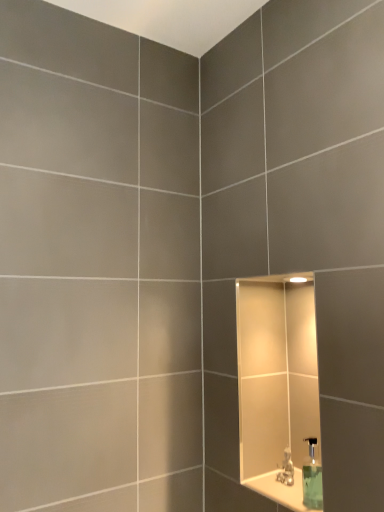
Question: From the image's perspective, does white glossy ledge at lower right appear lower than green translucent soap dispenser at lower right?

Choices:
 (A) no
 (B) yes

Answer: (B)

Question: Is white glossy ledge at lower right beside green translucent soap dispenser at lower right?

Choices:
 (A) yes
 (B) no

Answer: (A)

Question: Is white glossy ledge at lower right aimed at green translucent soap dispenser at lower right?

Choices:
 (A) no
 (B) yes

Answer: (A)

Question: Is green translucent soap dispenser at lower right surrounded by white glossy ledge at lower right?

Choices:
 (A) yes
 (B) no

Answer: (B)

Question: Does white glossy ledge at lower right appear on the left side of green translucent soap dispenser at lower right?

Choices:
 (A) yes
 (B) no

Answer: (B)

Question: Based on their sizes in the image, would you say satin nickel faucet at lower right is bigger or smaller than white glossy ledge at lower right?

Choices:
 (A) big
 (B) small

Answer: (B)

Question: From the image's perspective, is satin nickel faucet at lower right located above or below white glossy ledge at lower right?

Choices:
 (A) above
 (B) below

Answer: (A)

Question: Is satin nickel faucet at lower right taller or shorter than white glossy ledge at lower right?

Choices:
 (A) short
 (B) tall

Answer: (B)

Question: Does point (292, 466) appear closer or farther from the camera than point (279, 492)?

Choices:
 (A) farther
 (B) closer

Answer: (A)

Question: Looking at the image, does white glossy ledge at lower right seem bigger or smaller compared to green translucent soap dispenser at lower right?

Choices:
 (A) big
 (B) small

Answer: (B)

Question: Is point (306, 508) closer or farther from the camera than point (309, 441)?

Choices:
 (A) farther
 (B) closer

Answer: (B)

Question: Considering their positions, is white glossy ledge at lower right located in front of or behind green translucent soap dispenser at lower right?

Choices:
 (A) front
 (B) behind

Answer: (A)

Question: From the image's perspective, is white glossy ledge at lower right located above or below green translucent soap dispenser at lower right?

Choices:
 (A) above
 (B) below

Answer: (B)

Question: Looking at their shapes, would you say green translucent soap dispenser at lower right is wider or thinner than satin nickel faucet at lower right?

Choices:
 (A) thin
 (B) wide

Answer: (B)

Question: From the image's perspective, relative to satin nickel faucet at lower right, is green translucent soap dispenser at lower right above or below?

Choices:
 (A) above
 (B) below

Answer: (A)